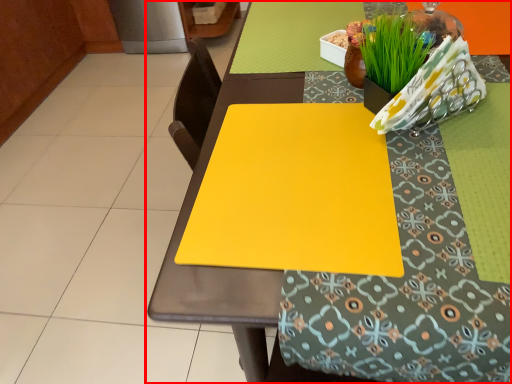
Question: From the image's perspective, considering the relative positions of table (annotated by the red box) and sheet in the image provided, where is table (annotated by the red box) located with respect to the staircase?

Choices:
 (A) above
 (B) below

Answer: (B)